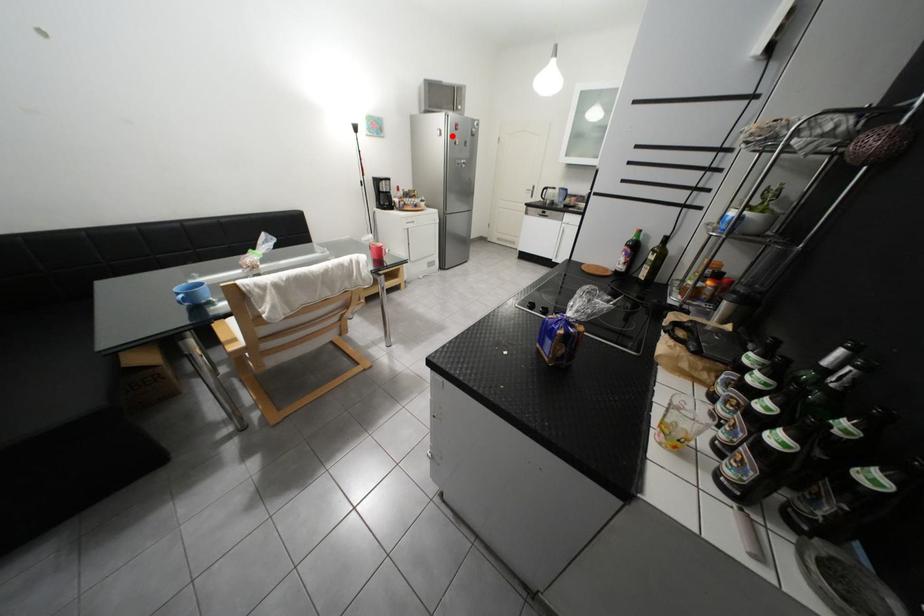
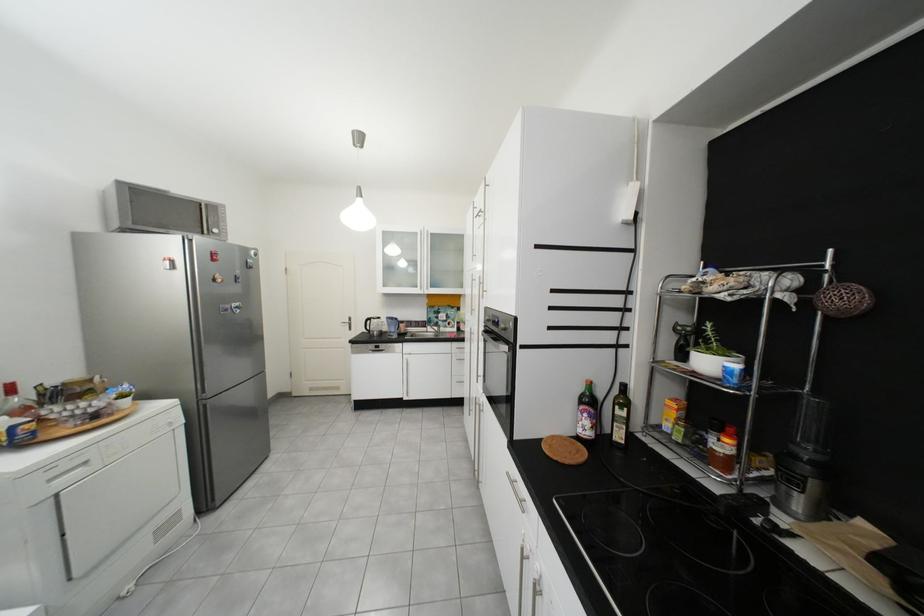
Locate, in the second image, the point that corresponds to the highlighted location in the first image.

(185, 269)